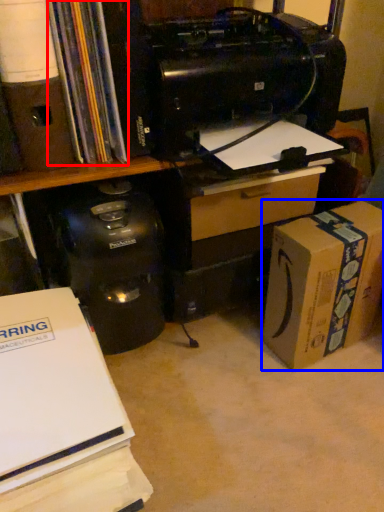
Question: Which object appears closest to the camera in this image, book (highlighted by a red box) or box (highlighted by a blue box)?

Choices:
 (A) book
 (B) box

Answer: (A)